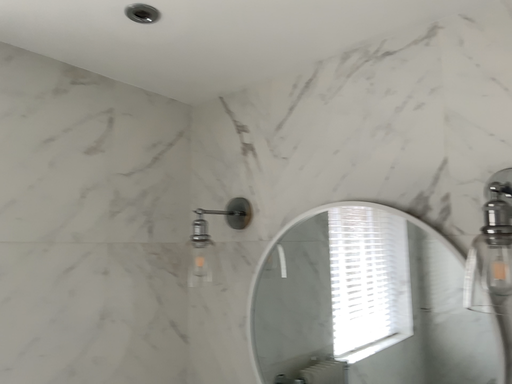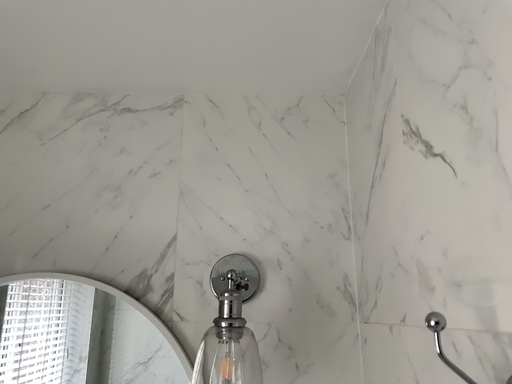
Question: Which way did the camera rotate in the video?

Choices:
 (A) rotated right
 (B) rotated left

Answer: (A)